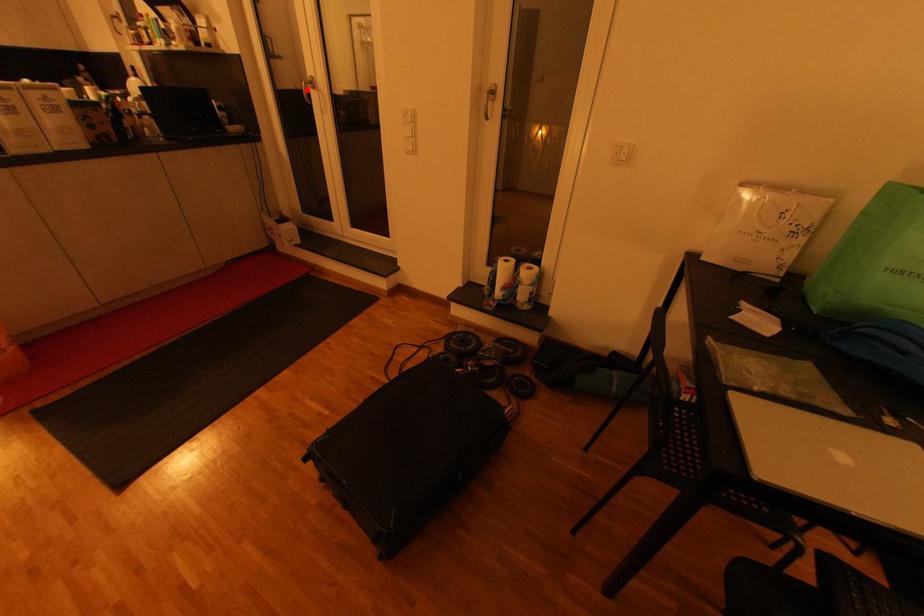
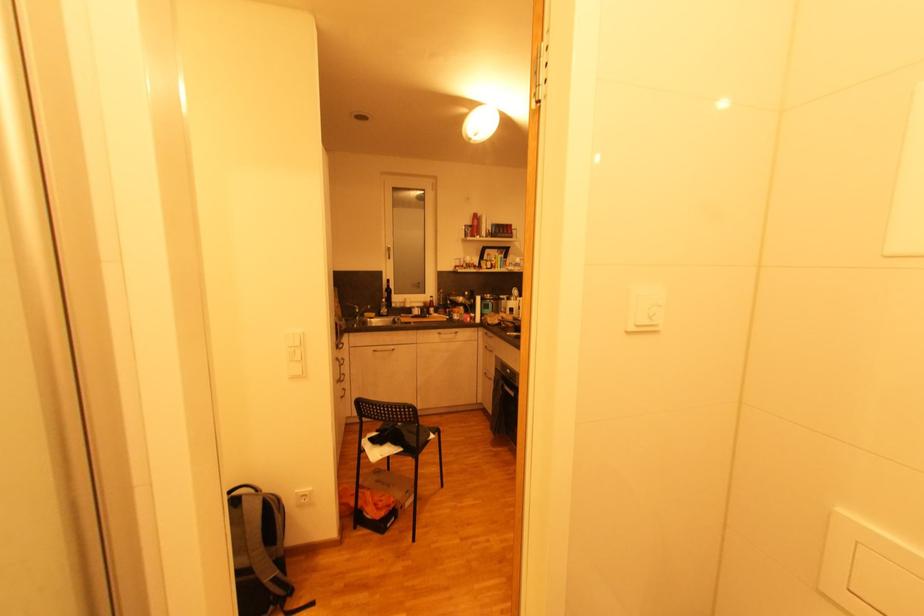
Question: I am providing you with two images of the same scene from different viewpoints. A red point is marked on the first image. Is the red point's position out of view in image 2?

Choices:
 (A) Yes
 (B) No

Answer: (A)